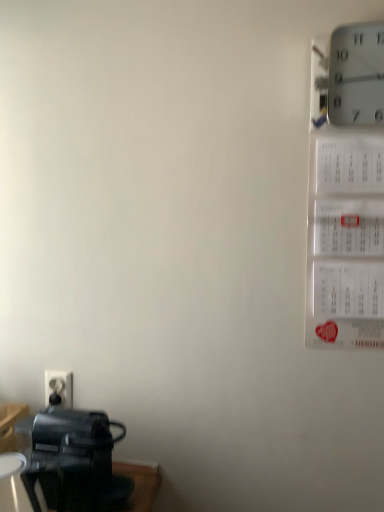
Question: Considering the positions of white plastic electric outlet at lower left and white plastic wall clock at upper right in the image, is white plastic electric outlet at lower left wider or thinner than white plastic wall clock at upper right?

Choices:
 (A) wide
 (B) thin

Answer: (B)

Question: Is white plastic electric outlet at lower left to the left or to the right of white plastic wall clock at upper right in the image?

Choices:
 (A) left
 (B) right

Answer: (A)

Question: Which of these objects is positioned closest to the white plastic electric outlet at lower left?

Choices:
 (A) white plastic wall clock at upper right
 (B) black plastic coffee maker at lower left

Answer: (B)

Question: Considering the real-world distances, which object is farthest from the white plastic electric outlet at lower left?

Choices:
 (A) black plastic coffee maker at lower left
 (B) white plastic wall clock at upper right

Answer: (B)